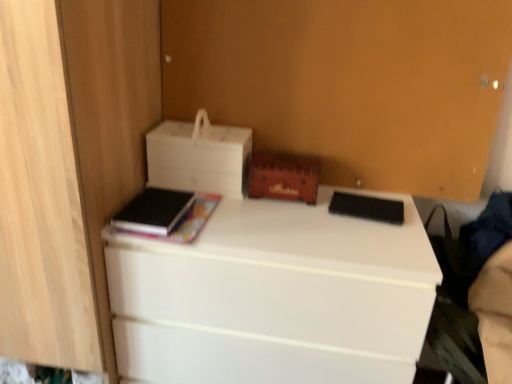
You are a GUI agent. You are given a task and a screenshot of the screen. Output one action in this format:
    pyautogui.click(x=<x>, y=<y>)
    Task: Click on the blank area to the left of black matte paperback book at center, the 2th paperback book when ordered from left to right
    This screenshot has height=384, width=512.
    Given the screenshot: What is the action you would take?
    pyautogui.click(x=312, y=214)